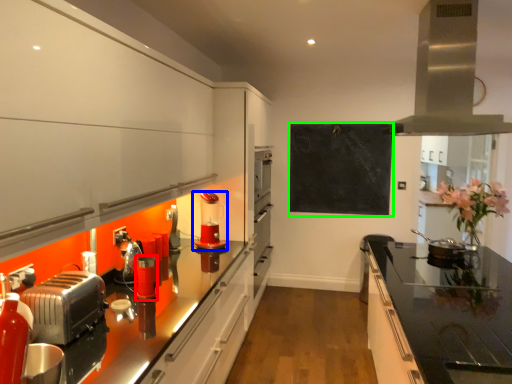
Question: Which object is the closest to the appliance (highlighted by a red box)? Choose among these: kitchen appliance (highlighted by a blue box) or bulletin board (highlighted by a green box).

Choices:
 (A) kitchen appliance
 (B) bulletin board

Answer: (A)